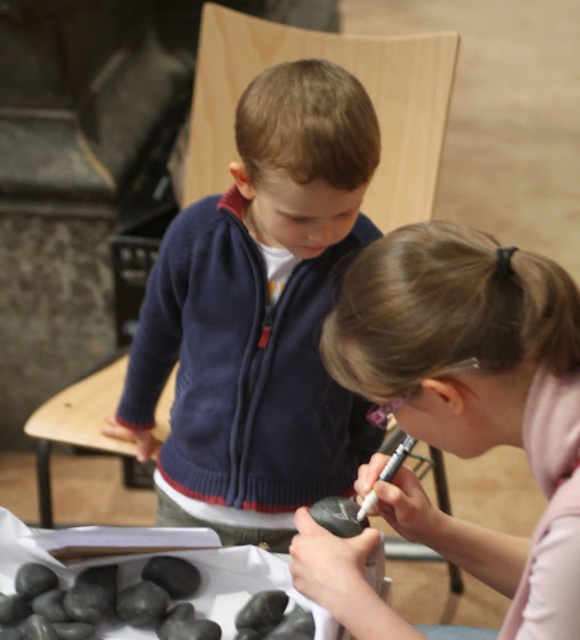
Is navy fleece sweater at center below smooth black rock at center?

No, navy fleece sweater at center is not below smooth black rock at center.

In the scene shown: Which is more to the right, navy fleece sweater at center or smooth black rock at center?

smooth black rock at center

Locate an element on the screen. This screenshot has height=640, width=580. navy fleece sweater at center is located at coordinates 259,316.